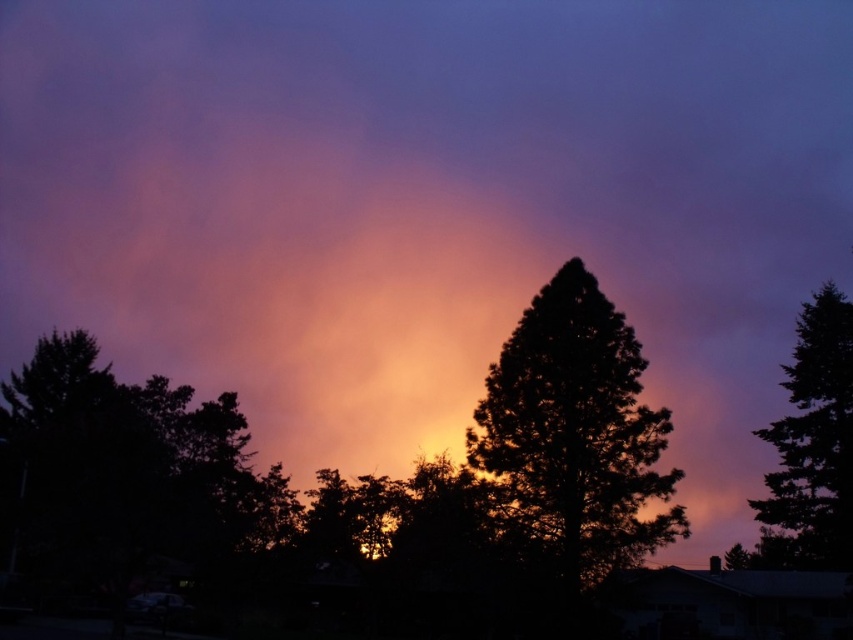
Question: Which point appears closest to the camera in this image?

Choices:
 (A) (78, 525)
 (B) (581, 387)
 (C) (840, 305)

Answer: (A)

Question: From the image, what is the correct spatial relationship of dark green textured tree at center in relation to dark green textured tree at right?

Choices:
 (A) right
 (B) left

Answer: (B)

Question: Does dark green textured tree at center have a lesser width compared to dark green textured tree at right?

Choices:
 (A) yes
 (B) no

Answer: (A)

Question: Which is farther from the dark green textured tree at center?

Choices:
 (A) dark green leafy tree at left
 (B) dark green textured tree at right

Answer: (B)

Question: Does dark green leafy tree at left have a lesser width compared to dark green textured tree at center?

Choices:
 (A) yes
 (B) no

Answer: (B)

Question: Among these objects, which one is nearest to the camera?

Choices:
 (A) dark green leafy tree at left
 (B) dark green textured tree at center

Answer: (A)